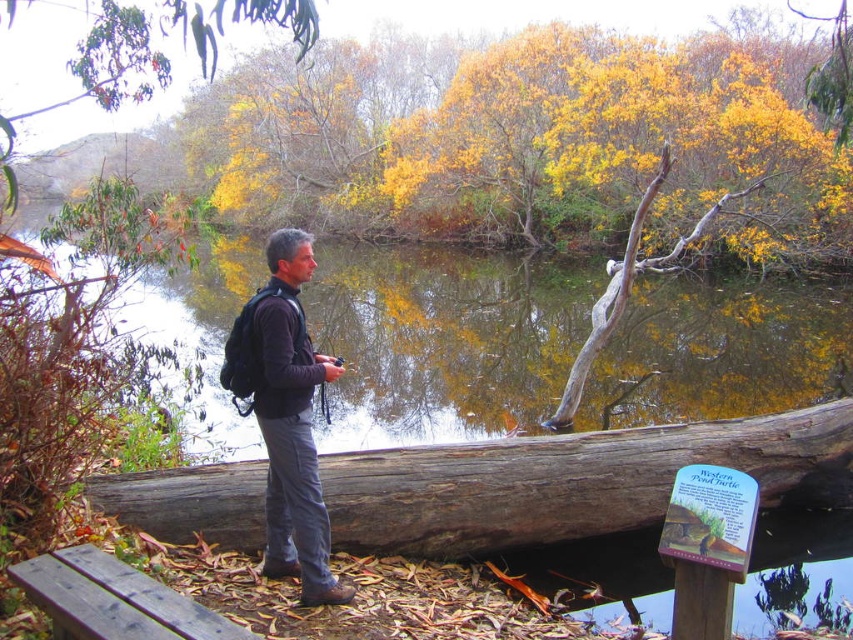
Question: Is yellow-green foliage at upper left thinner than wooden bench at lower left?

Choices:
 (A) yes
 (B) no

Answer: (B)

Question: Does greenish-brown water at center lie in front of weathered wood log at center?

Choices:
 (A) yes
 (B) no

Answer: (B)

Question: Which of these objects is positioned closest to the wooden bench at lower left?

Choices:
 (A) yellow-green foliage at upper left
 (B) yellow leafy tree at center
 (C) dark gray fabric jacket at center
 (D) greenish-brown water at center

Answer: (C)

Question: Which of the following is the farthest from the observer?

Choices:
 (A) dark gray fabric jacket at center
 (B) yellow leafy tree at center
 (C) weathered wood log at center
 (D) greenish-brown water at center

Answer: (D)

Question: Which object appears closest to the camera in this image?

Choices:
 (A) weathered wood log at center
 (B) dark gray fabric jacket at center

Answer: (B)

Question: Can you confirm if weathered wood log at center is positioned below yellow-green foliage at upper left?

Choices:
 (A) yes
 (B) no

Answer: (A)